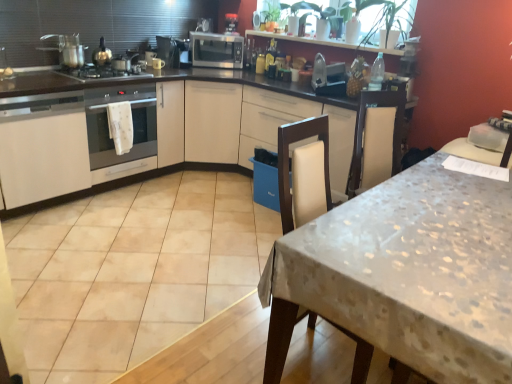
Question: Is satin silver gas stove at left far from metallic silver toaster at upper center, marked as the first appliance in a right-to-left arrangement?

Choices:
 (A) yes
 (B) no

Answer: (A)

Question: Is satin silver gas stove at left facing towards metallic silver toaster at upper center, which is the first appliance from bottom to top?

Choices:
 (A) yes
 (B) no

Answer: (B)

Question: Considering the relative sizes of satin silver gas stove at left and metallic silver toaster at upper center, which is the first appliance from bottom to top, in the image provided, is satin silver gas stove at left taller than metallic silver toaster at upper center, which is the first appliance from bottom to top,?

Choices:
 (A) yes
 (B) no

Answer: (B)

Question: Does satin silver gas stove at left have a greater width compared to metallic silver toaster at upper center, which is the first appliance from bottom to top?

Choices:
 (A) yes
 (B) no

Answer: (A)

Question: From a real-world perspective, is satin silver gas stove at left under metallic silver toaster at upper center, positioned as the first appliance in front-to-back order?

Choices:
 (A) yes
 (B) no

Answer: (A)

Question: Is white fabric towel at left in front of or behind metallic silver toaster at upper center, the 3th appliance when ordered from left to right, in the image?

Choices:
 (A) behind
 (B) front

Answer: (A)

Question: From a real-world perspective, is white fabric towel at left above or below metallic silver toaster at upper center, marked as the third appliance in a back-to-front arrangement?

Choices:
 (A) above
 (B) below

Answer: (B)

Question: Looking at their shapes, would you say white fabric towel at left is wider or thinner than metallic silver toaster at upper center, positioned as the first appliance in front-to-back order?

Choices:
 (A) wide
 (B) thin

Answer: (B)

Question: Based on their sizes in the image, would you say white fabric towel at left is bigger or smaller than metallic silver toaster at upper center, positioned as the first appliance in front-to-back order?

Choices:
 (A) big
 (B) small

Answer: (B)

Question: Based on their sizes in the image, would you say white fabric towel at left is bigger or smaller than satin silver gas stove at left?

Choices:
 (A) big
 (B) small

Answer: (B)

Question: From the image's perspective, relative to satin silver gas stove at left, is white fabric towel at left above or below?

Choices:
 (A) below
 (B) above

Answer: (A)

Question: From a real-world perspective, relative to satin silver gas stove at left, is white fabric towel at left vertically above or below?

Choices:
 (A) below
 (B) above

Answer: (A)

Question: Is point (128, 109) closer or farther from the camera than point (135, 72)?

Choices:
 (A) farther
 (B) closer

Answer: (B)

Question: In the image, is satin black microwave at upper center, the 2th appliance from the back, positioned in front of or behind satin silver microwave at center, acting as the first kitchen appliance starting from the back?

Choices:
 (A) behind
 (B) front

Answer: (B)

Question: In terms of size, does satin black microwave at upper center, which is the 2th appliance from top to bottom, appear bigger or smaller than satin silver microwave at center, which is the first kitchen appliance from top to bottom?

Choices:
 (A) big
 (B) small

Answer: (B)